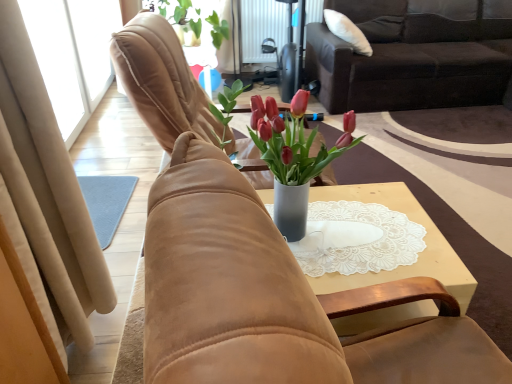
Locate an element on the screen. free space above white lace doily at center (from a real-world perspective) is located at coordinates (362, 228).